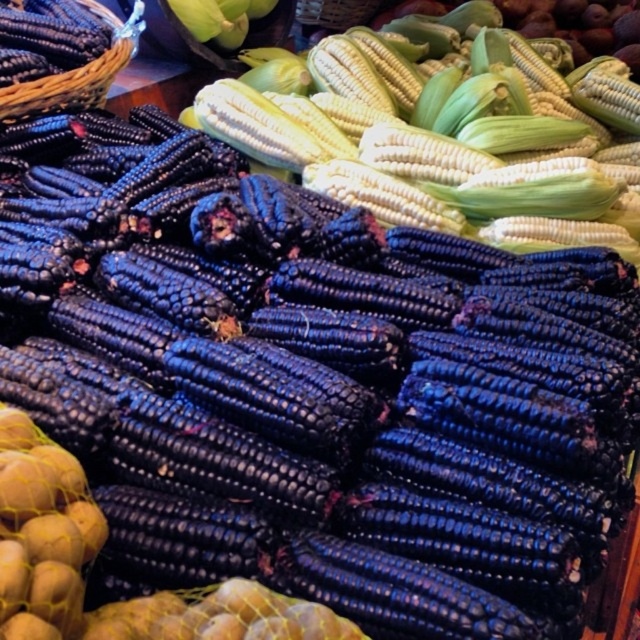
Based on the photo, you are standing at the market stall and want to pick up an item located at point (474, 208). Can you reach it without moving closer than 5 feet?

The distance of point (474, 208) from viewer is 5.46 feet, so you can reach it without moving closer than 5 feet since it is slightly farther away than 5 feet.

You are standing in front of the market stall and want to pick a corn cob. You notice two points marked on the display. Which point, point (580, 76) or point (125, 42), is closer to you?

Point (125, 42) is closer to you because it is less further to the camera than point (580, 76).